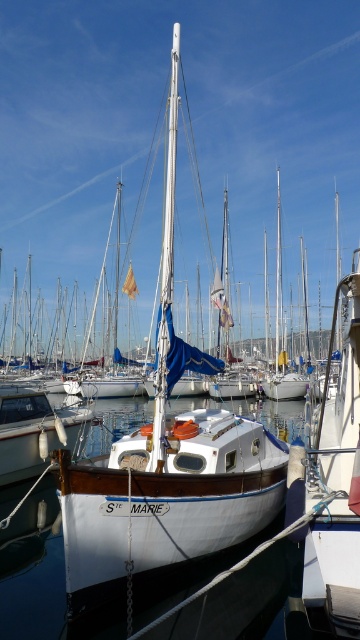
Which is in front, point (82, 465) or point (351, 305)?

Point (82, 465) is in front.

Can you confirm if white wood sailboat at center is taller than white matte sailboat at center?

Indeed, white wood sailboat at center has a greater height compared to white matte sailboat at center.

Is point (231, 435) farther from viewer compared to point (329, 465)?

Yes, point (231, 435) is farther from viewer.

I want to click on white wood sailboat at center, so click(167, 467).